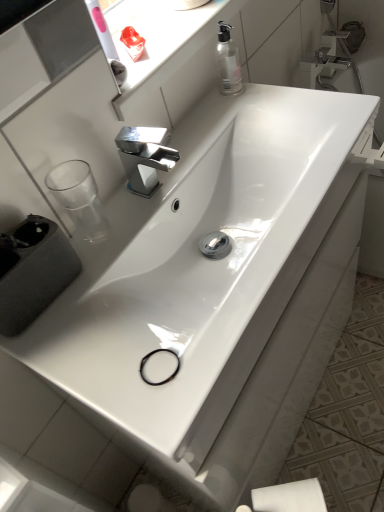
This screenshot has height=512, width=384. I want to click on free space between transparent plastic soap dispenser at upper right and polished chrome faucet at center, so click(x=200, y=133).